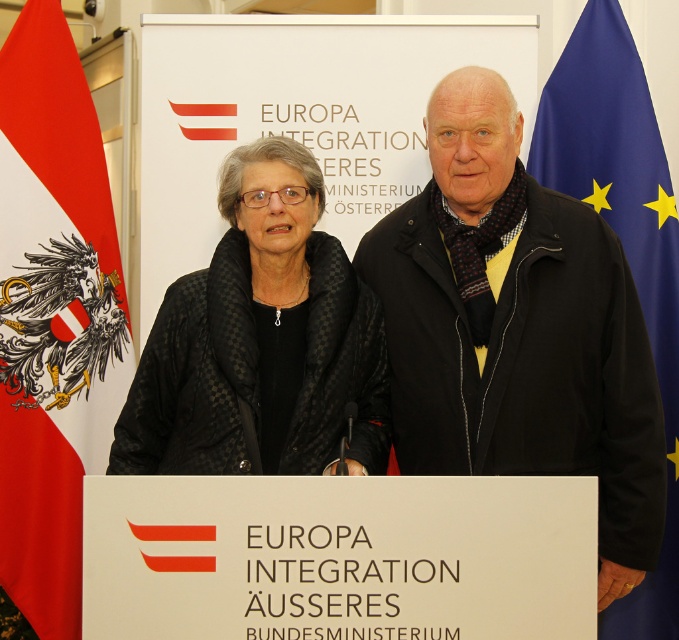
Does black matte jacket at center have a greater height compared to red fabric flag at left?

In fact, black matte jacket at center may be shorter than red fabric flag at left.

The height and width of the screenshot is (640, 679). I want to click on black matte jacket at center, so click(517, 328).

Who is more distant from viewer, (181, 429) or (566, 168)?

The point (566, 168) is more distant.

Which is in front, point (147, 417) or point (608, 632)?

Point (147, 417)

Who is more forward, (308, 419) or (614, 60)?

Point (308, 419)

This screenshot has width=679, height=640. I want to click on black textured coat at center, so click(261, 340).

From the picture: Between black textured coat at center and red fabric flag at left, which one has more height?

red fabric flag at left is taller.

Looking at this image, does black textured coat at center have a lesser width compared to red fabric flag at left?

Incorrect, black textured coat at center's width is not less than red fabric flag at left's.

Which is behind, point (297, 148) or point (3, 380)?

The point (3, 380) is more distant.

Locate an element on the screen. The image size is (679, 640). black textured coat at center is located at coordinates [x=261, y=340].